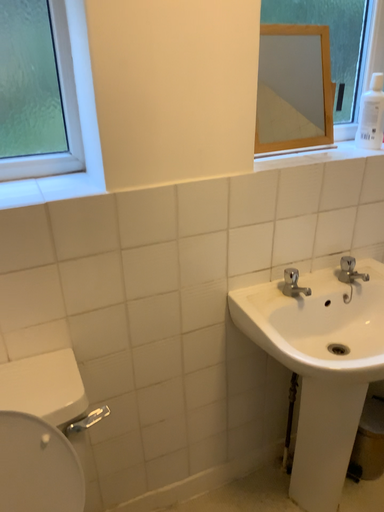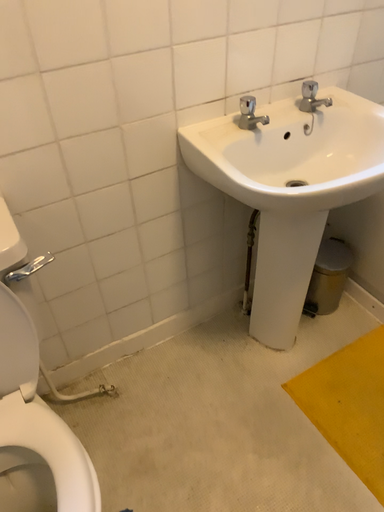
Question: How did the camera likely rotate when shooting the video?

Choices:
 (A) rotated upward
 (B) rotated downward

Answer: (B)